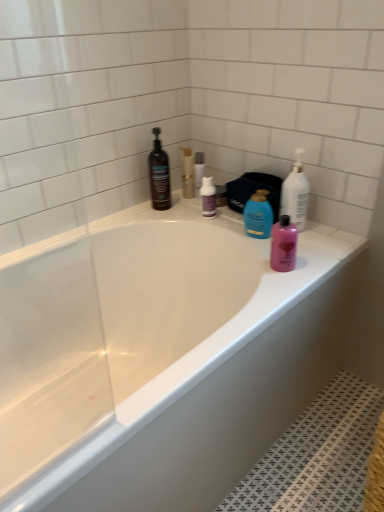
This screenshot has height=512, width=384. Identify the location of free space in front of clear plastic bottle at upper center, the second toiletry viewed from the left. (200, 210).